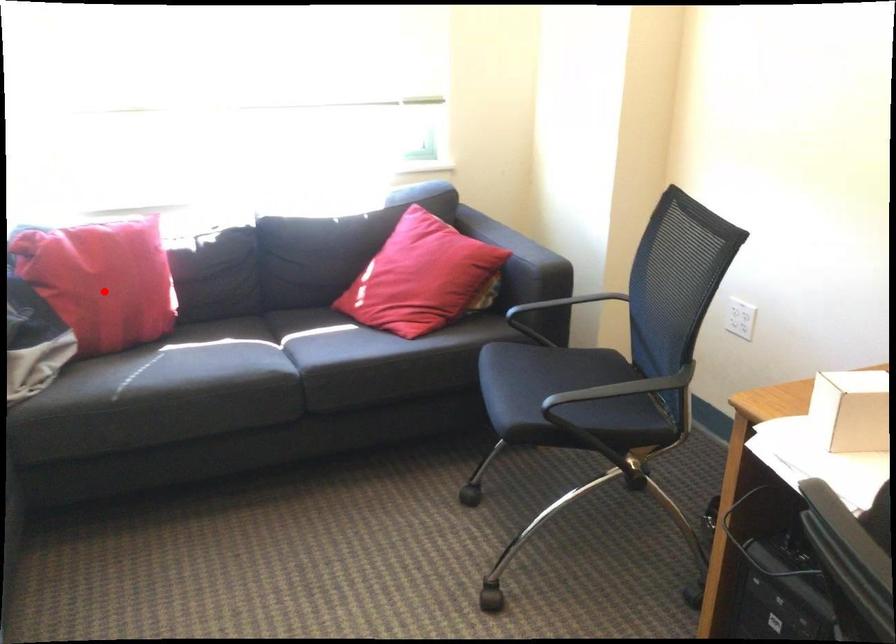
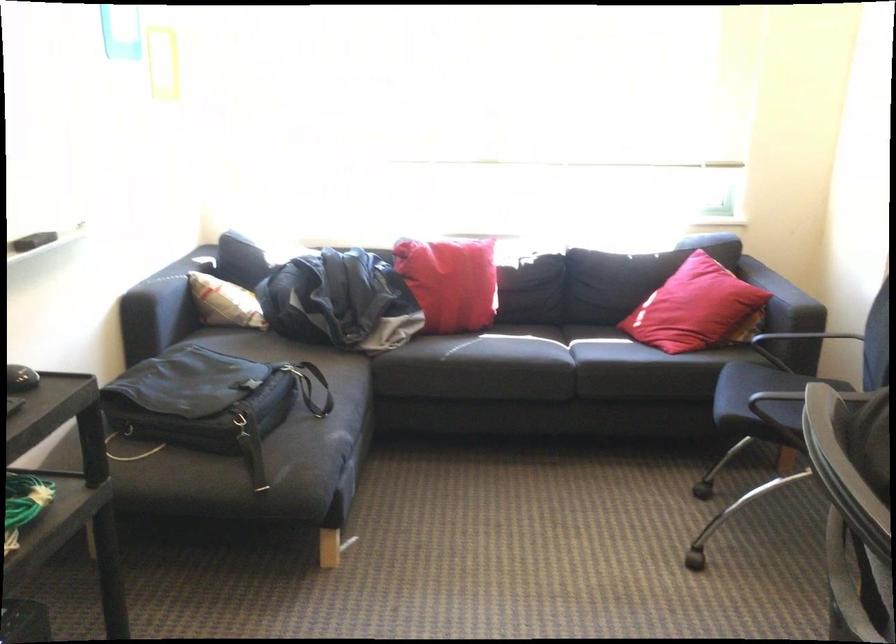
The point at the highlighted location is marked in the first image. Where is the corresponding point in the second image?

(450, 281)